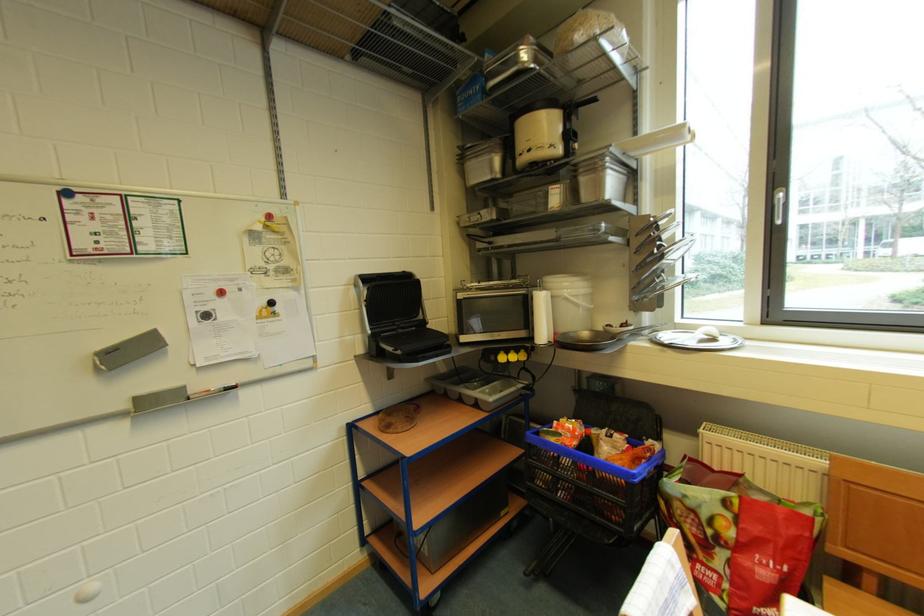
What do you see at coordinates (654, 221) in the screenshot? I see `a grill press handle` at bounding box center [654, 221].